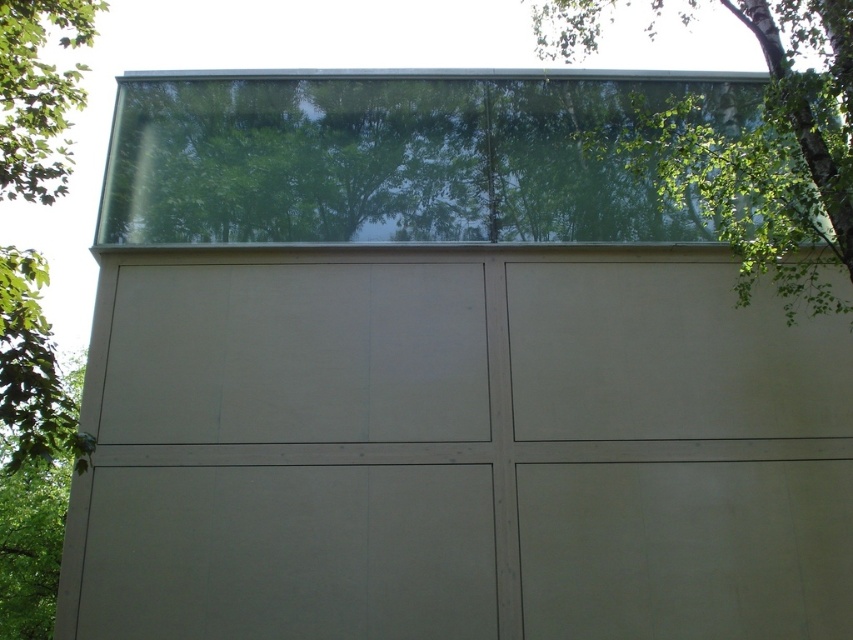
Question: Which of the following is the closest to the observer?

Choices:
 (A) transparent glass window at upper center
 (B) green leafy tree at upper right
 (C) green leafy tree at left

Answer: (C)

Question: Which of the following is the farthest from the observer?

Choices:
 (A) green leafy tree at left
 (B) transparent glass window at upper center

Answer: (B)

Question: Is matte beige garage door at center bigger than transparent glass window at upper center?

Choices:
 (A) yes
 (B) no

Answer: (A)

Question: Estimate the real-world distances between objects in this image. Which object is closer to the matte beige garage door at center?

Choices:
 (A) green leafy tree at left
 (B) transparent glass window at upper center

Answer: (B)

Question: Is transparent glass window at upper center bigger than green leafy tree at left?

Choices:
 (A) yes
 (B) no

Answer: (A)

Question: Can you confirm if matte beige garage door at center is bigger than green leafy tree at upper right?

Choices:
 (A) yes
 (B) no

Answer: (A)